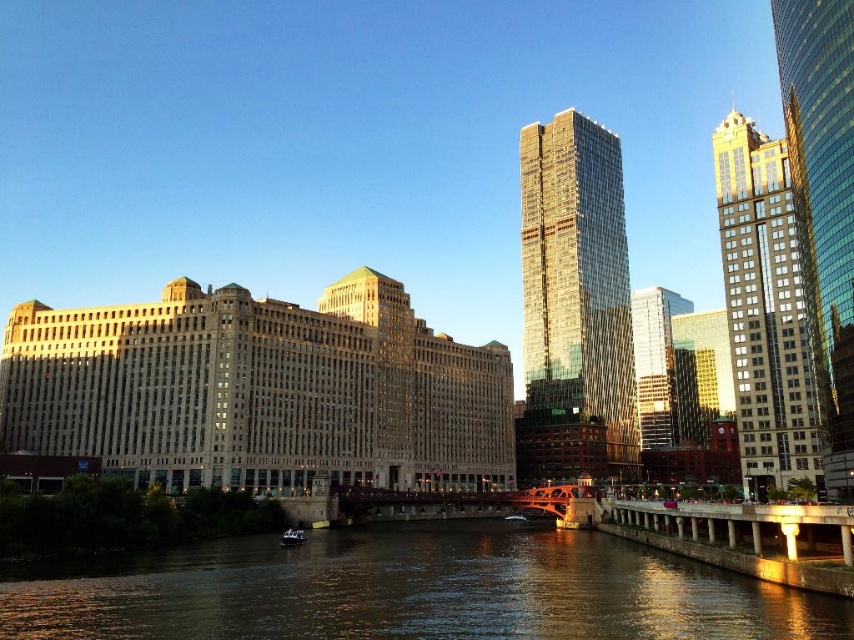
You are a delivery drone that needs to fly from the gold reflective glass skyscraper at upper right to the white plastic boat at center. The minimum safe distance between the drone and any object is 5 meters. Can you safely make this flight without violating the safety distance?

The gold reflective glass skyscraper at upper right and white plastic boat at center are 49.36 meters apart from each other. Since the minimum safe distance is 5 meters, the drone can safely fly between them as the distance is more than sufficient.

Looking at this image, you are a photographer planning to take a photo of the shiny glass skyscraper at center and the white plastic boat at center from the left side of the historic building. Which object will appear larger in your photo?

The shiny glass skyscraper at center will appear larger in the photo because it is bigger than the white plastic boat at center.